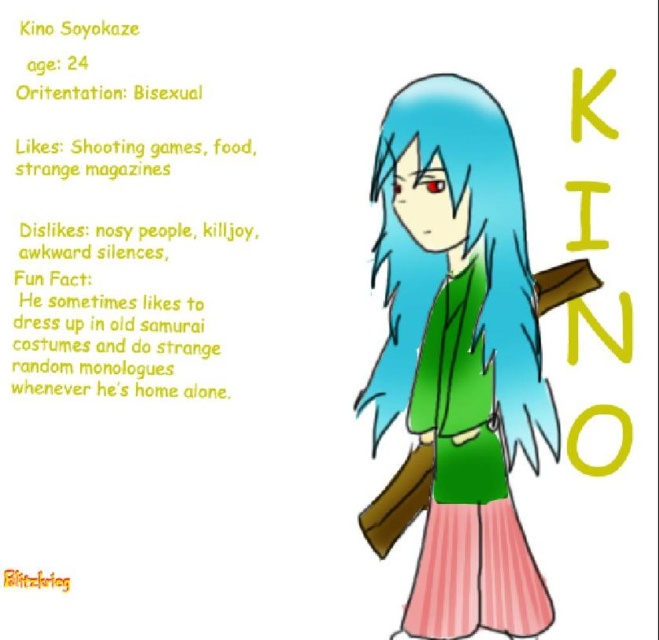
You are a costume designer preparing to create a replica of Kino Soyokaze. You have two items to place on a display stand. The matte green dress at center and the brushed metal blitzkrieg at lower left. Which item requires a wider display stand to accommodate its width?

The matte green dress at center requires a wider display stand because its width surpasses that of the brushed metal blitzkrieg at lower left.

Based on the scene description, where is the green fabric jacket at center located in terms of coordinates?

The green fabric jacket at center is located at coordinates point [132,156].

From the picture: Based on the scene description, which object is taller between the matte green dress at center and the brushed metal blitzkrieg at lower left?

The matte green dress at center is taller than the brushed metal blitzkrieg at lower left according to the description.